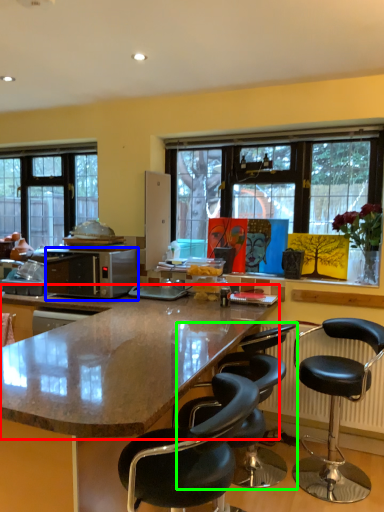
Question: Which object is the farthest from countertop (highlighted by a red box)? Choose among these: microwave oven (highlighted by a blue box) or chair (highlighted by a green box).

Choices:
 (A) microwave oven
 (B) chair

Answer: (A)